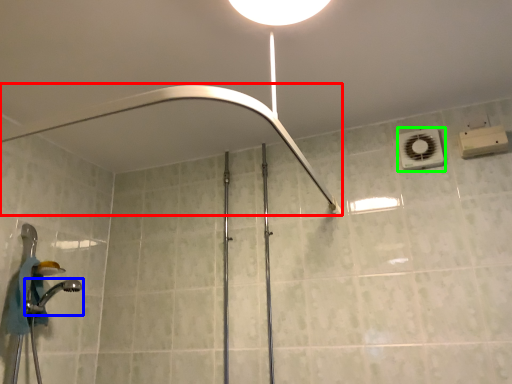
Question: Which object is the farthest from shower (highlighted by a red box)? Choose among these: shower (highlighted by a blue box) or air conditioner (highlighted by a green box).

Choices:
 (A) shower
 (B) air conditioner

Answer: (A)